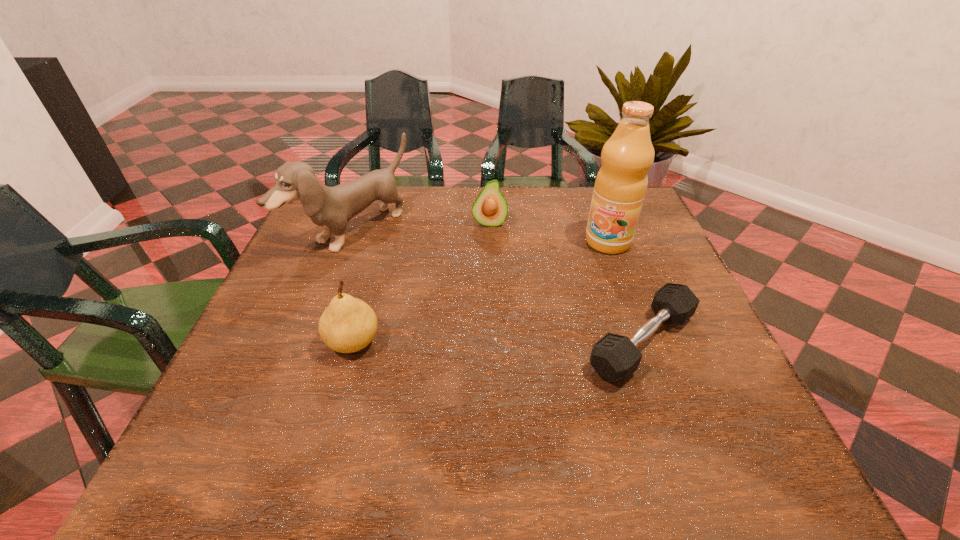
The width and height of the screenshot is (960, 540). Find the location of `vacant spot on the desktop that is between the pear and the dumbbell and is positioned at the face of the second tallest object`. vacant spot on the desktop that is between the pear and the dumbbell and is positioned at the face of the second tallest object is located at coordinates (530, 342).

Where is `free space on the desktop that is between the pear and the dumbbell and is positioned on the cut side of the avocado`? free space on the desktop that is between the pear and the dumbbell and is positioned on the cut side of the avocado is located at coordinates (488, 342).

Image resolution: width=960 pixels, height=540 pixels. I want to click on vacant space on the desktop that is between the pear and the shortest object and is positioned on the front label of the tallest object, so click(x=527, y=342).